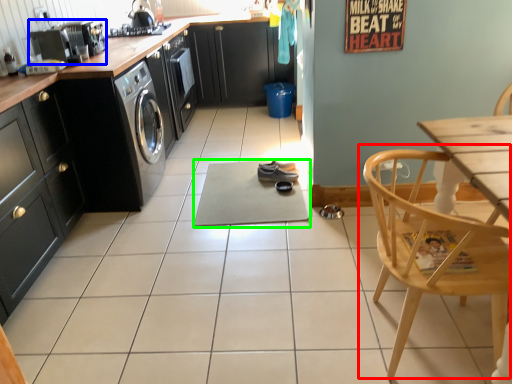
Question: Considering the real-world distances, which object is farthest from chair (highlighted by a red box)? kitchen appliance (highlighted by a blue box) or yoga mat (highlighted by a green box)?

Choices:
 (A) kitchen appliance
 (B) yoga mat

Answer: (A)